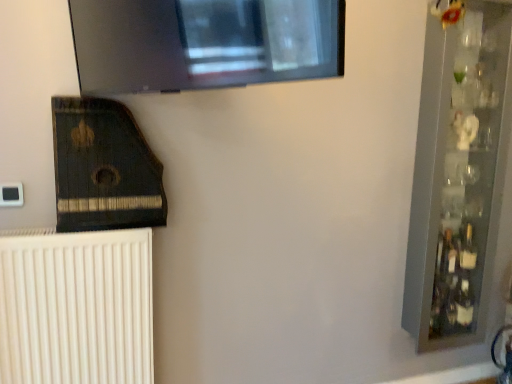
Question: Does dark wood harp at lower left have a smaller size compared to white ribbed radiator at lower left?

Choices:
 (A) no
 (B) yes

Answer: (B)

Question: Is dark wood harp at lower left at the right side of white ribbed radiator at lower left?

Choices:
 (A) no
 (B) yes

Answer: (B)

Question: From the image's perspective, is dark wood harp at lower left under white ribbed radiator at lower left?

Choices:
 (A) no
 (B) yes

Answer: (A)

Question: Is dark wood harp at lower left not inside white ribbed radiator at lower left?

Choices:
 (A) no
 (B) yes

Answer: (B)

Question: Is dark wood harp at lower left turned away from white ribbed radiator at lower left?

Choices:
 (A) yes
 (B) no

Answer: (B)

Question: Is white ribbed radiator at lower left in front of or behind dark wood harp at lower left in the image?

Choices:
 (A) behind
 (B) front

Answer: (A)

Question: Based on their sizes in the image, would you say white ribbed radiator at lower left is bigger or smaller than dark wood harp at lower left?

Choices:
 (A) big
 (B) small

Answer: (A)

Question: Is point (71, 238) closer or farther from the camera than point (67, 139)?

Choices:
 (A) closer
 (B) farther

Answer: (A)

Question: Considering the relative positions of white ribbed radiator at lower left and dark wood harp at lower left in the image provided, is white ribbed radiator at lower left to the left or to the right of dark wood harp at lower left?

Choices:
 (A) left
 (B) right

Answer: (A)

Question: Which is correct: dark wood harp at lower left is inside clear glass bottle at right, or outside of it?

Choices:
 (A) outside
 (B) inside

Answer: (A)

Question: Is point (132, 218) closer or farther from the camera than point (455, 258)?

Choices:
 (A) closer
 (B) farther

Answer: (A)

Question: From a real-world perspective, is dark wood harp at lower left above or below clear glass bottle at right?

Choices:
 (A) below
 (B) above

Answer: (B)

Question: In terms of width, does dark wood harp at lower left look wider or thinner when compared to clear glass bottle at right?

Choices:
 (A) wide
 (B) thin

Answer: (A)

Question: In terms of width, does white ribbed radiator at lower left look wider or thinner when compared to clear glass shelf at right?

Choices:
 (A) thin
 (B) wide

Answer: (A)

Question: From their relative heights in the image, would you say white ribbed radiator at lower left is taller or shorter than clear glass shelf at right?

Choices:
 (A) tall
 (B) short

Answer: (B)